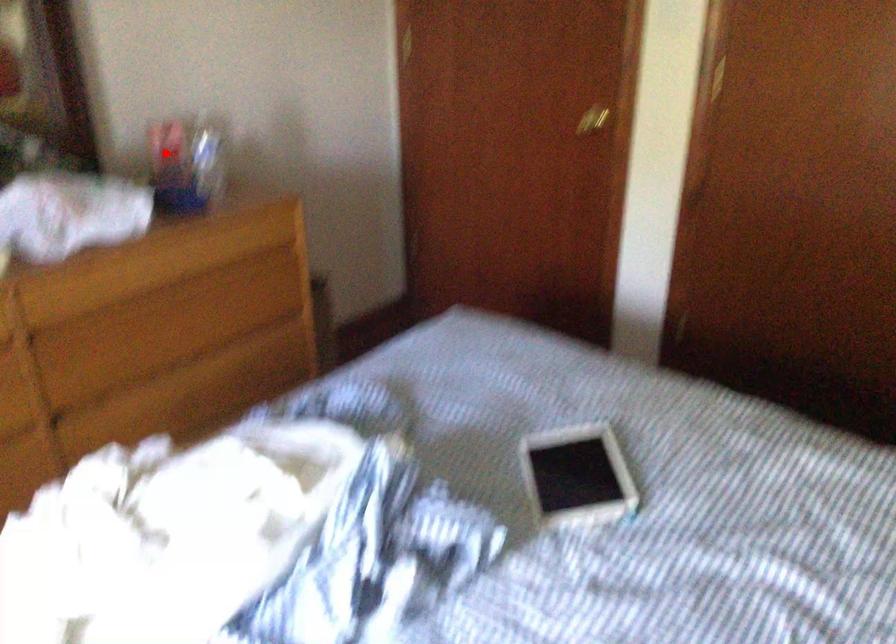
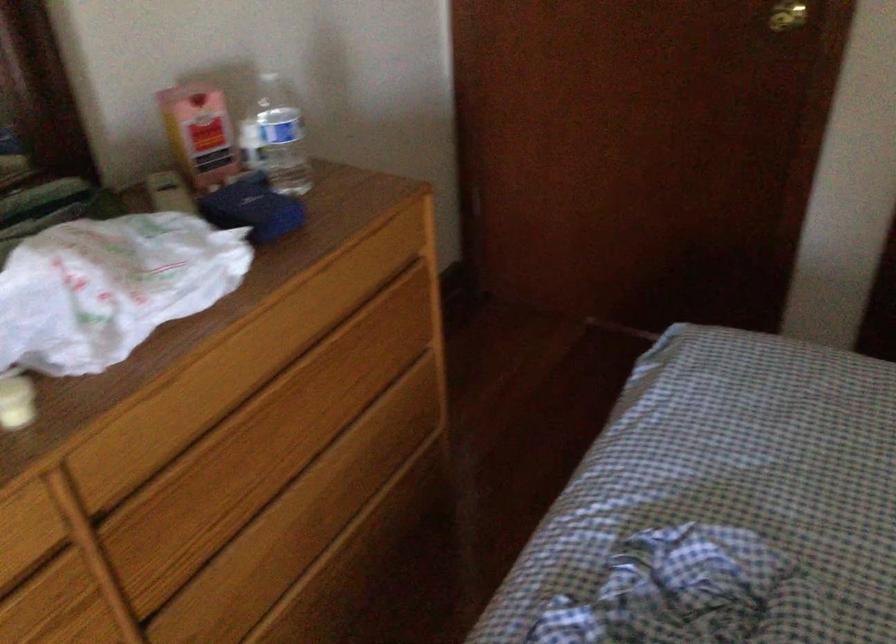
In the second image, find the point that corresponds to the highlighted location in the first image.

(200, 134)